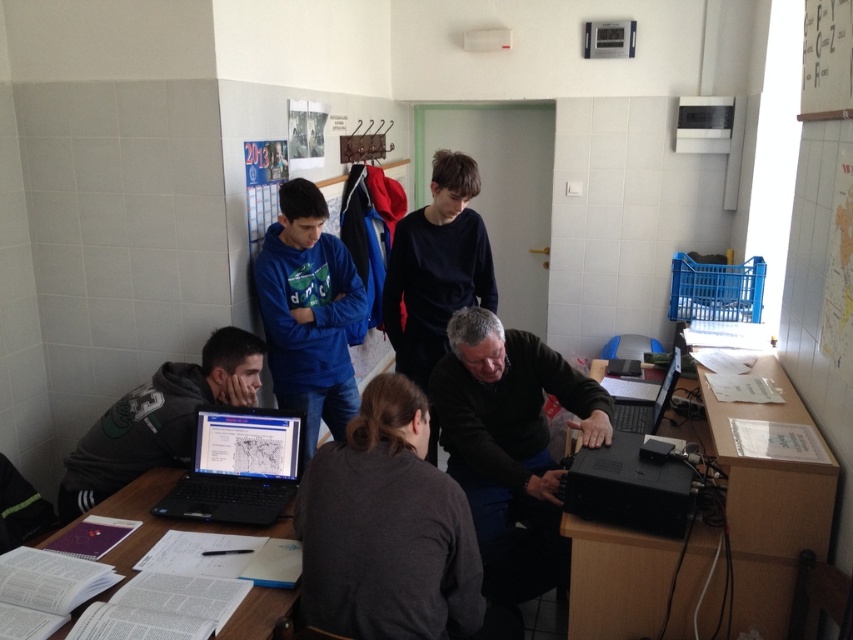
In the scene shown: You are a visitor in the room and want to take a photo of the black plastic computer at lower right and the white paper at lower left. Which object will appear larger in your photo?

The black plastic computer at lower right will appear larger in your photo because it is closer to the viewer than the white paper at lower left.

You are a delivery person who needs to place a 1 meter long package on the desk. The package must be placed between the matte black computer at center and the white paper at lower left. Is there enough space for the package to fit horizontally between these two items?

The distance between the matte black computer at center and the white paper at lower left is 83.50 centimeters. Since the package is 1 meter long, which is longer than the available space, it will not fit horizontally between them.

You are organizing a meeting in this room and need to place a 15 cm wide notebook between the black plastic computer at lower right and the white paper at lower left. Can the notebook fit between them based on their widths?

The black plastic computer at lower right has a lesser width compared to white paper at lower left, so the notebook can fit between them as there is sufficient space.